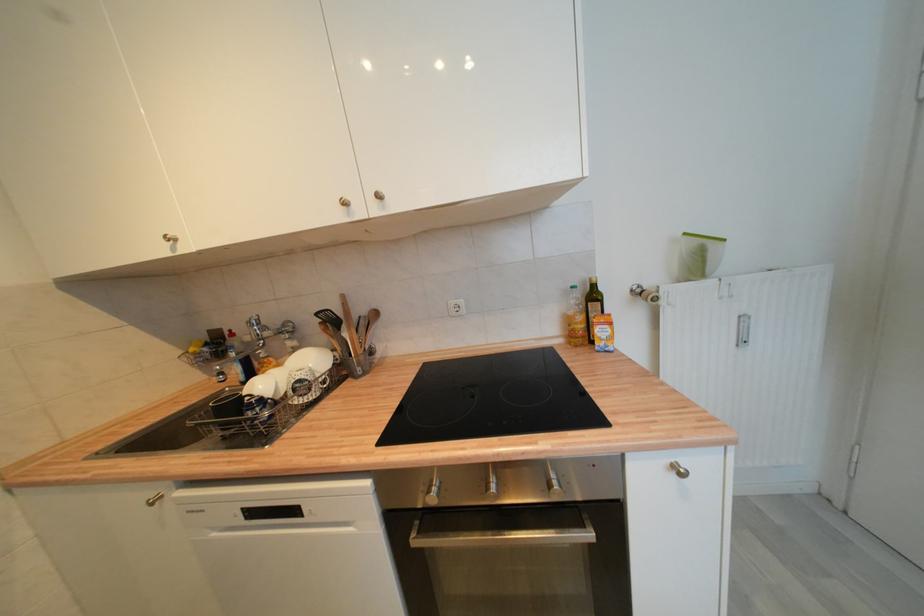
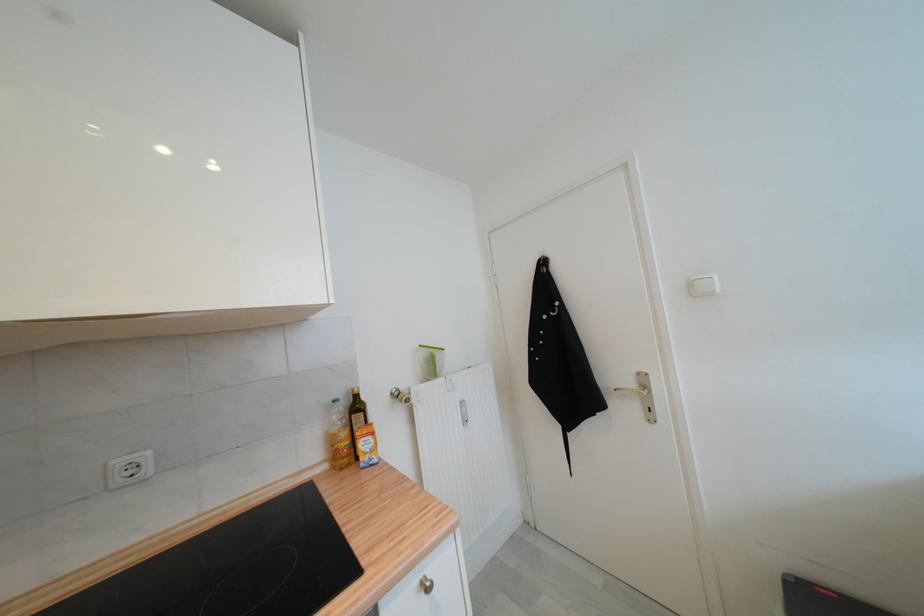
Locate, in the second image, the point that corresponds to [689,236] in the first image.

(426, 347)